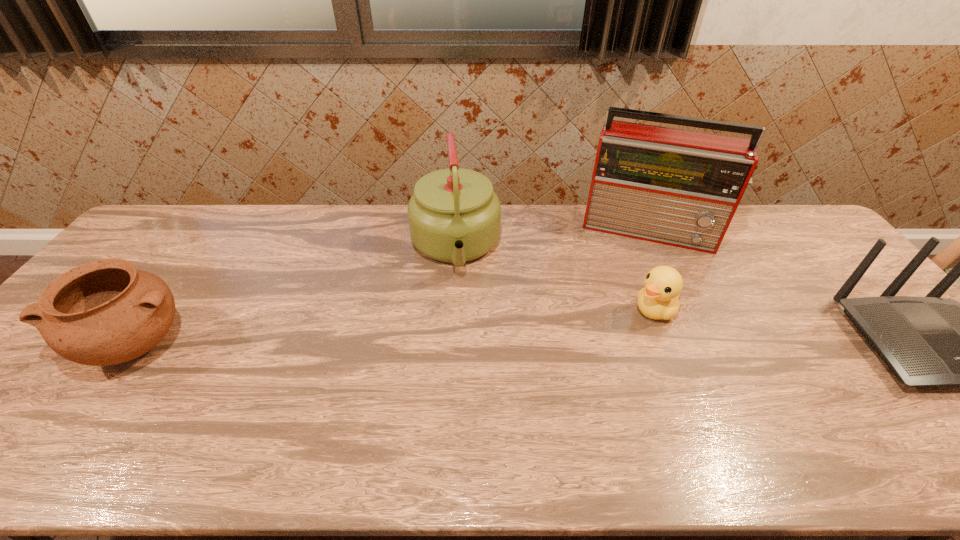
Locate an element on the screen. free spot on the desktop that is between the pottery and the router and is positioned on the face of the duck is located at coordinates (603, 343).

I want to click on free space on the desktop that is between the pottery and the router and is positioned on the front-facing side of the radio receiver, so click(x=636, y=343).

Locate an element on the screen. The height and width of the screenshot is (540, 960). vacant spot on the desktop that is between the pottery and the router and is positioned at the spout of the second tallest object is located at coordinates (466, 344).